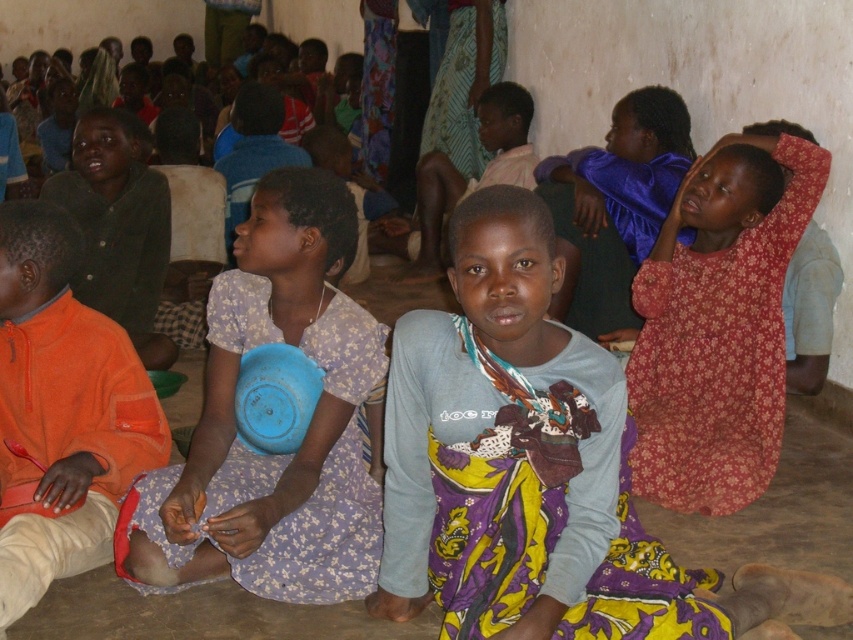
Based on the scene description, can you determine which clothing item, the shiny purple blouse at upper right or the dark green shirt at upper left, is closer to the viewer?

The shiny purple blouse at upper right is positioned over the dark green shirt at upper left, so it is closer to the viewer.

Based on the photo, based on the scene description, which object is taller between the shiny purple blouse at upper right and the dark green shirt at upper left?

The shiny purple blouse at upper right is much taller than the dark green shirt at upper left according to the description.